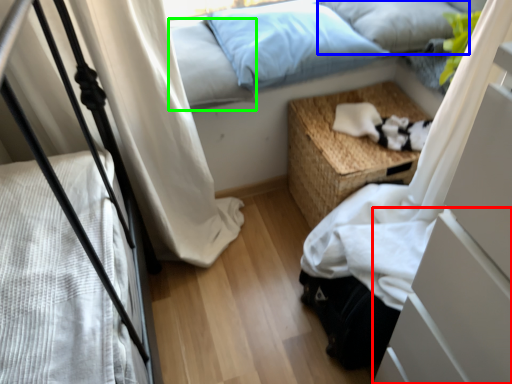
Question: Considering the real-world distances, which object is farthest from drawer (highlighted by a red box)? pillow (highlighted by a blue box) or pillow (highlighted by a green box)?

Choices:
 (A) pillow
 (B) pillow

Answer: (A)